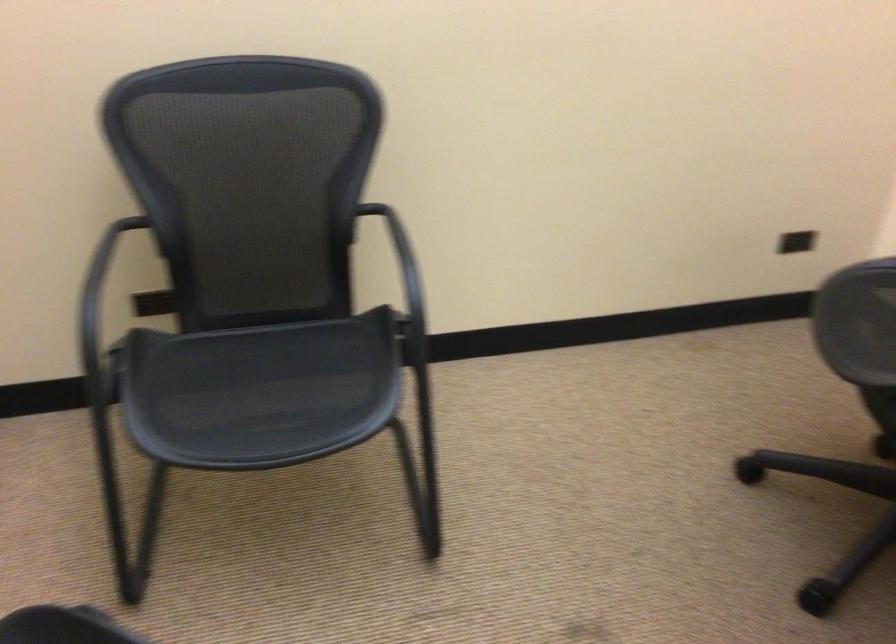
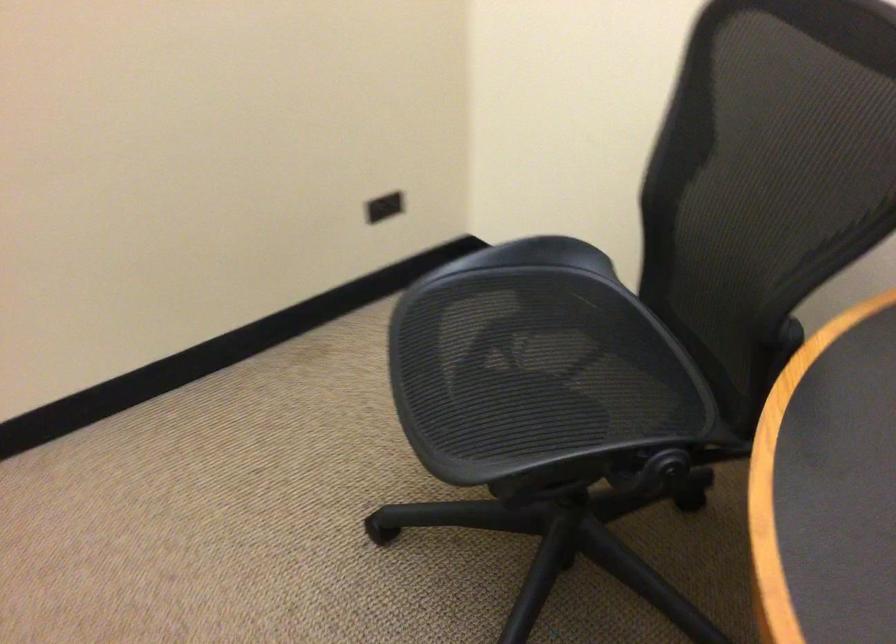
Which direction would the cameraman need to move to produce the second image?

The cameraman walked toward right, forward.